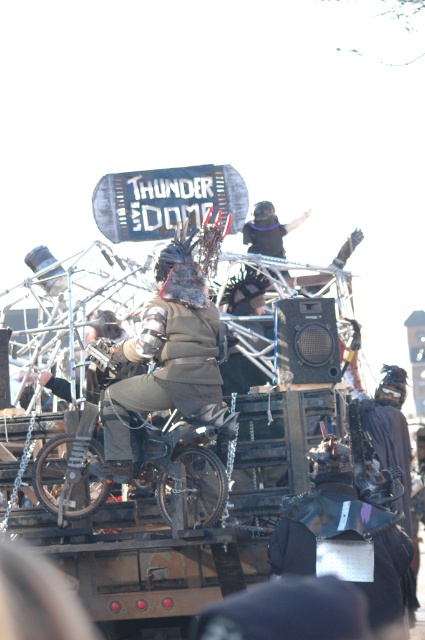
You are a participant in the parade and notice two helmets on the Thunder Doom float. The metallic silver helmet at center and the black matte helmet at upper center. Which helmet is positioned lower on the float?

The metallic silver helmet at center is positioned lower on the float because it is below the black matte helmet at upper center.

You are a photographer standing in the crowd, and you want to take a photo of the dark brown leather jacket at center and the black matte helmet at upper center. Which object should you focus on first if you want to capture both in the same frame without moving the camera?

The dark brown leather jacket at center is much taller than the black matte helmet at upper center, so you should focus on the dark brown leather jacket at center first to ensure both are in frame.

You are a photographer trying to capture both the dark brown leather jacket at center and the black matte helmet at upper center in a single frame. Which object should you position closer to the left side of your camera viewfinder to ensure both are included?

The dark brown leather jacket at center is to the left of the black matte helmet at upper center, so you should position the dark brown leather jacket at center closer to the left side of your camera viewfinder to include both in the frame.